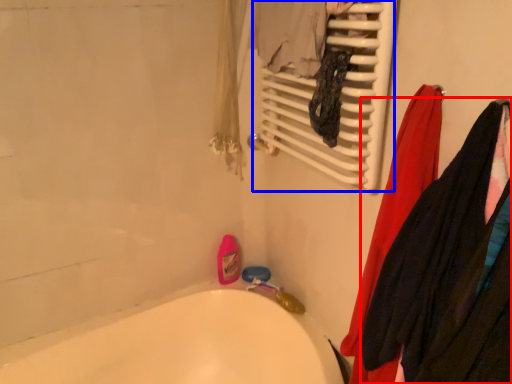
Question: Which of the following is the closest to the observer, clothing (highlighted by a red box) or radiator (highlighted by a blue box)?

Choices:
 (A) clothing
 (B) radiator

Answer: (A)